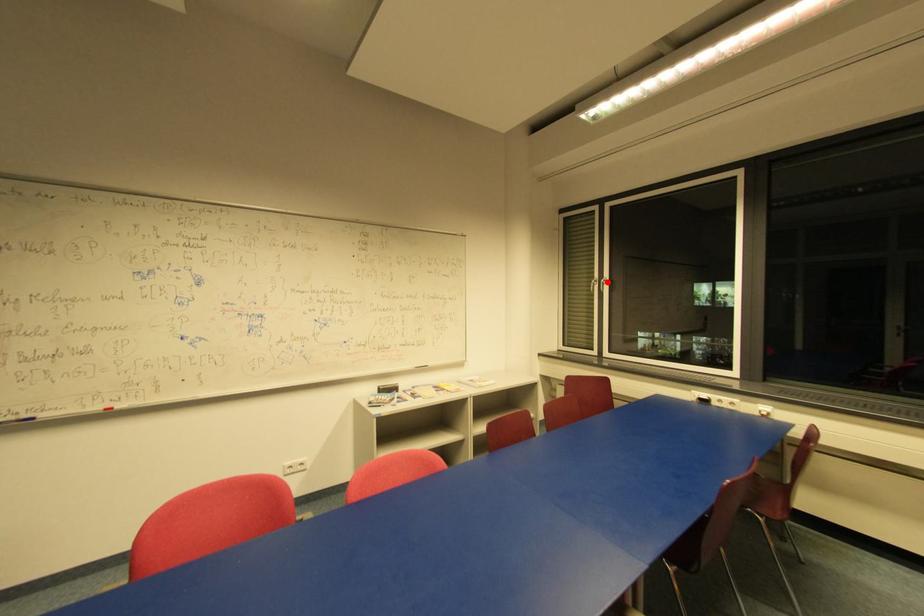
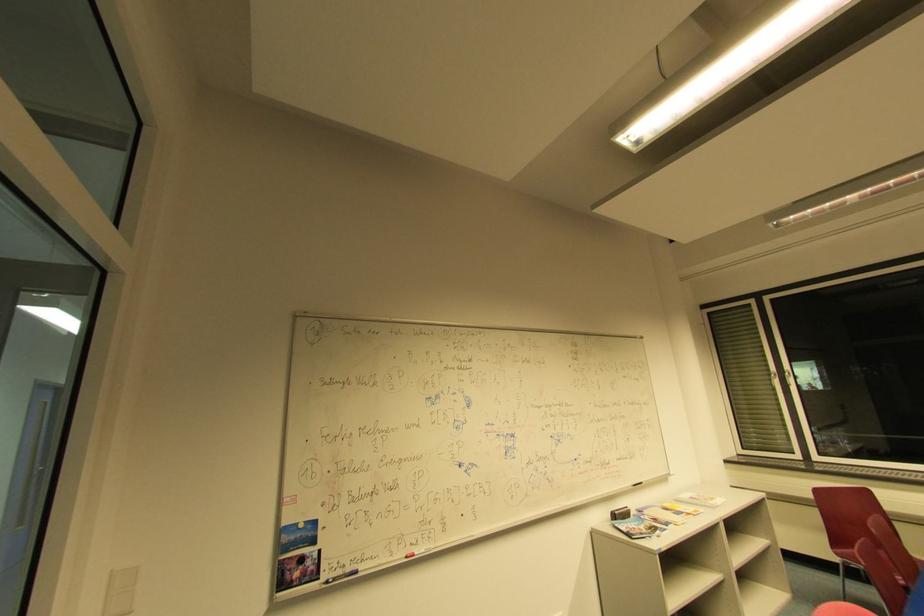
In the second image, find the point that corresponds to the highlighted location in the first image.

(791, 375)